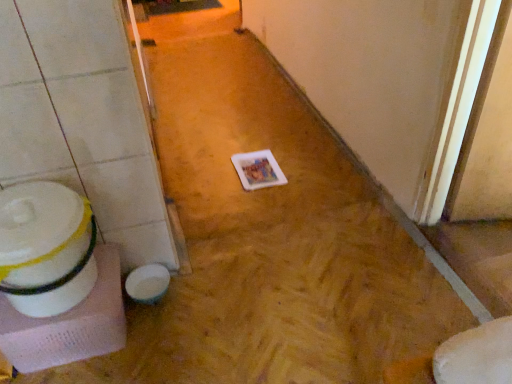
Describe the element at coordinates (46, 248) in the screenshot. The width and height of the screenshot is (512, 384). I see `white plastic potty at left` at that location.

Image resolution: width=512 pixels, height=384 pixels. In order to click on white plastic potty at left in this screenshot , I will do `click(46, 248)`.

Find the location of `white plastic potty at left`. white plastic potty at left is located at coordinates (46, 248).